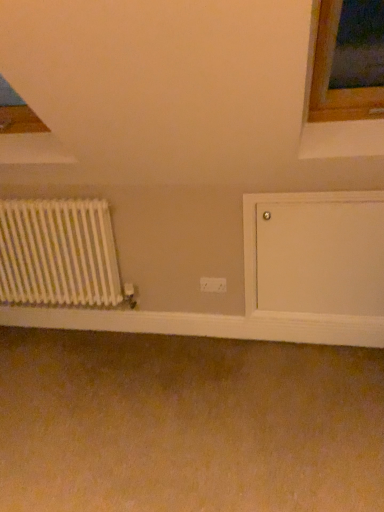
Where is `white smooth wood at lower center`? The height and width of the screenshot is (512, 384). white smooth wood at lower center is located at coordinates (207, 324).

I want to click on white smooth wood at lower center, so click(x=207, y=324).

Does point (20, 316) appear closer or farther from the camera than point (203, 285)?

Point (20, 316) is positioned farther from the camera compared to point (203, 285).

The width and height of the screenshot is (384, 512). Find the location of `window sill lying below the white plastic electric outlet at center (from the image's perspective)`. window sill lying below the white plastic electric outlet at center (from the image's perspective) is located at coordinates (207, 324).

Who is more distant, white smooth wood at lower center or white plastic electric outlet at center?

white plastic electric outlet at center is more distant.

Is white smooth wood at lower center far away from white plastic electric outlet at center?

They are positioned close to each other.

Is white smooth wood at lower center oriented away from white matte radiator at left?

No, white matte radiator at left is not at the back of white smooth wood at lower center.

From a real-world perspective, relative to white matte radiator at left, is white smooth wood at lower center vertically above or below?

white smooth wood at lower center is below white matte radiator at left.

Is white smooth wood at lower center further to the viewer compared to white matte radiator at left?

Yes, the depth of white smooth wood at lower center is greater than that of white matte radiator at left.

From the image's perspective, between white matte radiator at left and white plastic electric outlet at center, who is located below?

white plastic electric outlet at center is shown below in the image.

Which object is further away from the camera taking this photo, white matte radiator at left or white plastic electric outlet at center?

white plastic electric outlet at center is behind.

Identify the location of radiator above the white plastic electric outlet at center (from a real-world perspective). This screenshot has width=384, height=512. (58, 253).

Looking at this image, which of these two, white matte radiator at left or white plastic electric outlet at center, stands shorter?

white plastic electric outlet at center.

Is white plastic electric outlet at center inside the boundaries of white smooth wood at lower center, or outside?

white plastic electric outlet at center is spatially situated outside white smooth wood at lower center.

In terms of size, does white plastic electric outlet at center appear bigger or smaller than white smooth wood at lower center?

Clearly, white plastic electric outlet at center is smaller in size than white smooth wood at lower center.

Which point is more distant from viewer, [204,277] or [210,321]?

The point [210,321] is more distant.

Between white plastic electric outlet at center and white smooth wood at lower center, which one appears on the left side from the viewer's perspective?

white smooth wood at lower center.

Between white matte radiator at left and white smooth wood at lower center, which one has more height?

white matte radiator at left is taller.

Can you confirm if white matte radiator at left is positioned to the left of white smooth wood at lower center?

Yes, white matte radiator at left is to the left of white smooth wood at lower center.

Who is bigger, white matte radiator at left or white smooth wood at lower center?

With larger size is white matte radiator at left.

Is white matte radiator at left in front of or behind white smooth wood at lower center in the image?

white matte radiator at left is positioned closer to the viewer than white smooth wood at lower center.

Consider the image. How distant is white plastic electric outlet at center from white matte radiator at left?

30.90 inches.

Considering the positions of objects white plastic electric outlet at center and white matte radiator at left in the image provided, who is more to the right, white plastic electric outlet at center or white matte radiator at left?

From the viewer's perspective, white plastic electric outlet at center appears more on the right side.

Considering the sizes of white plastic electric outlet at center and white matte radiator at left in the image, is white plastic electric outlet at center wider or thinner than white matte radiator at left?

Considering their sizes, white plastic electric outlet at center looks slimmer than white matte radiator at left.

Considering the positions of points (211, 279) and (2, 249), is point (211, 279) closer to camera compared to point (2, 249)?

Yes, point (211, 279) is in front of point (2, 249).

Find the location of a particular element. This screenshot has width=384, height=512. electric outlet lying behind the white smooth wood at lower center is located at coordinates (213, 284).

At what (x,y) coordinates should I click in order to perform the action: click on radiator in front of the white smooth wood at lower center. Please return your answer as a coordinate pair (x, y). This screenshot has width=384, height=512. Looking at the image, I should click on (58, 253).

Based on their spatial positions, is white smooth wood at lower center or white plastic electric outlet at center further from white matte radiator at left?

white plastic electric outlet at center.

Based on their spatial positions, is white matte radiator at left or white plastic electric outlet at center closer to white smooth wood at lower center?

Among the two, white matte radiator at left is located nearer to white smooth wood at lower center.

When comparing their distances from white plastic electric outlet at center, does white matte radiator at left or white smooth wood at lower center seem further?

Among the two, white matte radiator at left is located further to white plastic electric outlet at center.

Estimate the real-world distances between objects in this image. Which object is further from white plastic electric outlet at center, white smooth wood at lower center or white matte radiator at left?

white matte radiator at left.

When comparing their distances from white matte radiator at left, does white plastic electric outlet at center or white smooth wood at lower center seem closer?

white smooth wood at lower center.

Estimate the real-world distances between objects in this image. Which object is closer to white smooth wood at lower center, white plastic electric outlet at center or white matte radiator at left?

white matte radiator at left is closer to white smooth wood at lower center.

Where is `window sill situated between white matte radiator at left and white plastic electric outlet at center from left to right`? This screenshot has height=512, width=384. window sill situated between white matte radiator at left and white plastic electric outlet at center from left to right is located at coordinates (207, 324).